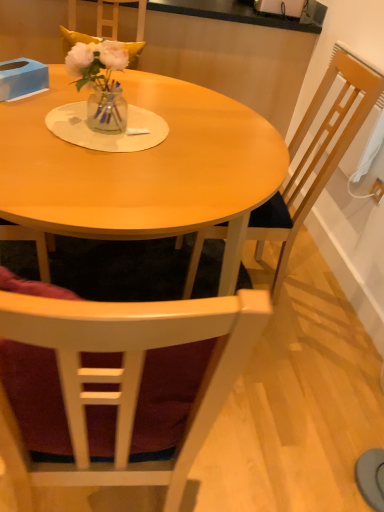
Question: Does blue cardboard box at upper left have a smaller size compared to matte wood table at center?

Choices:
 (A) yes
 (B) no

Answer: (A)

Question: Is blue cardboard box at upper left far away from matte wood table at center?

Choices:
 (A) no
 (B) yes

Answer: (A)

Question: From the image's perspective, is blue cardboard box at upper left under matte wood table at center?

Choices:
 (A) no
 (B) yes

Answer: (A)

Question: Is blue cardboard box at upper left bigger than matte wood table at center?

Choices:
 (A) no
 (B) yes

Answer: (A)

Question: Is blue cardboard box at upper left positioned beyond the bounds of matte wood table at center?

Choices:
 (A) no
 (B) yes

Answer: (B)

Question: From a real-world perspective, is blue cardboard box at upper left located beneath matte wood table at center?

Choices:
 (A) no
 (B) yes

Answer: (A)

Question: Is wooden chair at right, the second chair when ordered from bottom to top, facing towards blue cardboard box at upper left?

Choices:
 (A) yes
 (B) no

Answer: (A)

Question: Is wooden chair at right, the second chair when ordered from bottom to top, completely or partially outside of blue cardboard box at upper left?

Choices:
 (A) no
 (B) yes

Answer: (B)

Question: Can you confirm if wooden chair at right, the second chair when ordered from bottom to top, is shorter than blue cardboard box at upper left?

Choices:
 (A) no
 (B) yes

Answer: (A)

Question: From a real-world perspective, is wooden chair at right, positioned as the 1th chair in top-to-bottom order, physically below blue cardboard box at upper left?

Choices:
 (A) no
 (B) yes

Answer: (B)

Question: Can you confirm if wooden chair at right, positioned as the 1th chair in top-to-bottom order, is positioned to the left of blue cardboard box at upper left?

Choices:
 (A) yes
 (B) no

Answer: (B)

Question: Can you see wooden chair at right, positioned as the 1th chair in top-to-bottom order, touching blue cardboard box at upper left?

Choices:
 (A) yes
 (B) no

Answer: (B)

Question: Does blue cardboard box at upper left have a larger size compared to translucent glass vase at center?

Choices:
 (A) no
 (B) yes

Answer: (A)